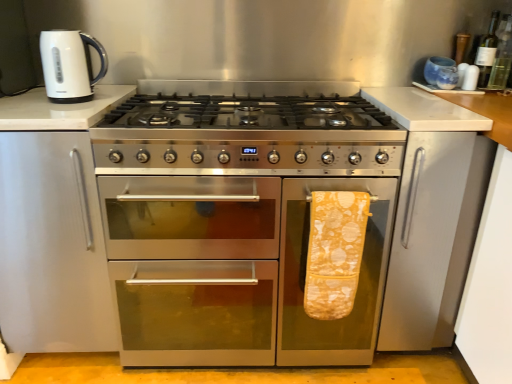
Question: Is green glass bottle at upper right, placed as the 1th bottle when sorted from right to left, positioned in front of yellow printed towel at right?

Choices:
 (A) yes
 (B) no

Answer: (B)

Question: From a real-world perspective, is green glass bottle at upper right, positioned as the second bottle in left-to-right order, physically below yellow printed towel at right?

Choices:
 (A) no
 (B) yes

Answer: (A)

Question: Does green glass bottle at upper right, positioned as the second bottle in left-to-right order, appear on the left side of yellow printed towel at right?

Choices:
 (A) no
 (B) yes

Answer: (A)

Question: Could yellow printed towel at right be considered to be inside green glass bottle at upper right, placed as the 1th bottle when sorted from right to left?

Choices:
 (A) no
 (B) yes

Answer: (A)

Question: Considering the relative sizes of green glass bottle at upper right, placed as the 1th bottle when sorted from right to left, and yellow printed towel at right in the image provided, is green glass bottle at upper right, placed as the 1th bottle when sorted from right to left, shorter than yellow printed towel at right?

Choices:
 (A) no
 (B) yes

Answer: (B)

Question: Looking at the image, does green glass bottle at upper right, the 1th bottle when ordered from left to right, seem bigger or smaller compared to stainless steel oven at center?

Choices:
 (A) small
 (B) big

Answer: (A)

Question: In the image, is green glass bottle at upper right, which ranks as the 2th bottle in right-to-left order, positioned in front of or behind stainless steel oven at center?

Choices:
 (A) front
 (B) behind

Answer: (B)

Question: Is green glass bottle at upper right, the 1th bottle when ordered from left to right, spatially inside stainless steel oven at center, or outside of it?

Choices:
 (A) outside
 (B) inside

Answer: (A)

Question: From the image's perspective, is green glass bottle at upper right, the 1th bottle when ordered from left to right, above or below stainless steel oven at center?

Choices:
 (A) below
 (B) above

Answer: (B)

Question: Is yellow printed towel at right in front of or behind green glass bottle at upper right, positioned as the second bottle in left-to-right order, in the image?

Choices:
 (A) front
 (B) behind

Answer: (A)

Question: From the image's perspective, relative to green glass bottle at upper right, placed as the 1th bottle when sorted from right to left, is yellow printed towel at right above or below?

Choices:
 (A) above
 (B) below

Answer: (B)

Question: Is yellow printed towel at right inside or outside of green glass bottle at upper right, positioned as the second bottle in left-to-right order?

Choices:
 (A) outside
 (B) inside

Answer: (A)

Question: In the image, is yellow printed towel at right on the left side or the right side of green glass bottle at upper right, positioned as the second bottle in left-to-right order?

Choices:
 (A) right
 (B) left

Answer: (B)

Question: From a real-world perspective, is green glass bottle at upper right, the 1th bottle when ordered from left to right, above or below yellow printed towel at right?

Choices:
 (A) below
 (B) above

Answer: (B)

Question: From the image's perspective, is green glass bottle at upper right, the 1th bottle when ordered from left to right, positioned above or below yellow printed towel at right?

Choices:
 (A) below
 (B) above

Answer: (B)